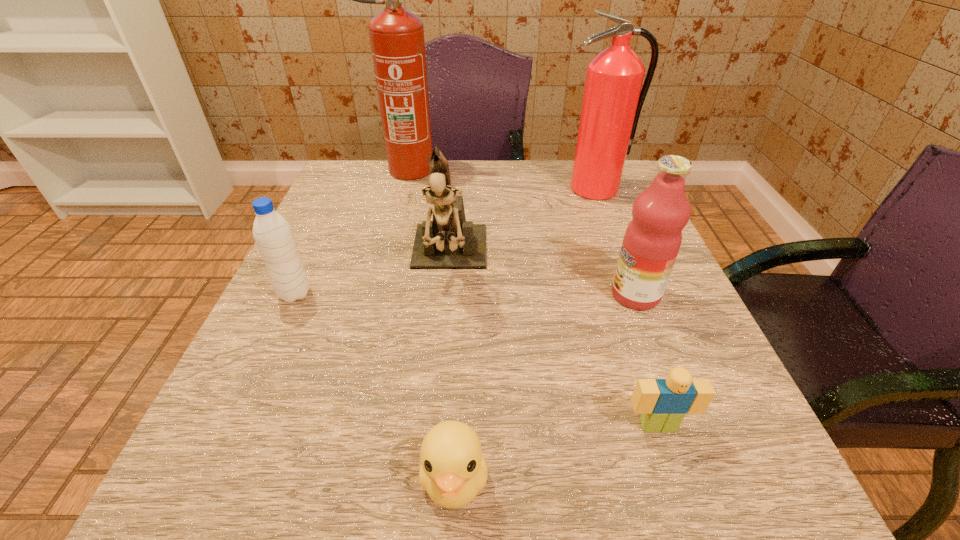
In the image, there is a desktop. At what (x,y) coordinates should I click in order to perform the action: click on vacant space at the near right corner. Please return your answer as a coordinate pair (x, y). Image resolution: width=960 pixels, height=540 pixels. Looking at the image, I should click on (707, 470).

At what (x,y) coordinates should I click in order to perform the action: click on free space between the duck and the fifth tallest object. Please return your answer as a coordinate pair (x, y). Looking at the image, I should click on (374, 387).

Where is `free space between the taller fire extinguisher and the shorter fire extinguisher`? The height and width of the screenshot is (540, 960). free space between the taller fire extinguisher and the shorter fire extinguisher is located at coordinates (498, 180).

You are a GUI agent. You are given a task and a screenshot of the screen. Output one action in this format:
    pyautogui.click(x=<x>, y=<y>)
    Task: Click on the free space between the fruit juice and the duck
    
    Given the screenshot: What is the action you would take?
    coord(545,387)

The height and width of the screenshot is (540, 960). I want to click on empty space that is in between the fruit juice and the sixth farthest object, so click(647, 360).

Locate an element on the screen. The width and height of the screenshot is (960, 540). vacant area that lies between the nearest object and the second nearest object is located at coordinates (556, 452).

Locate an element on the screen. The width and height of the screenshot is (960, 540). free space between the nearest object and the shorter fire extinguisher is located at coordinates (525, 334).

Identify the location of free space between the nearest object and the water bottle. (374, 387).

The width and height of the screenshot is (960, 540). What are the coordinates of `free space that is in between the fifth tallest object and the taller fire extinguisher` in the screenshot? It's located at (348, 232).

Where is `vacant space that's between the fruit juice and the sixth farthest object`? vacant space that's between the fruit juice and the sixth farthest object is located at coordinates (647, 360).